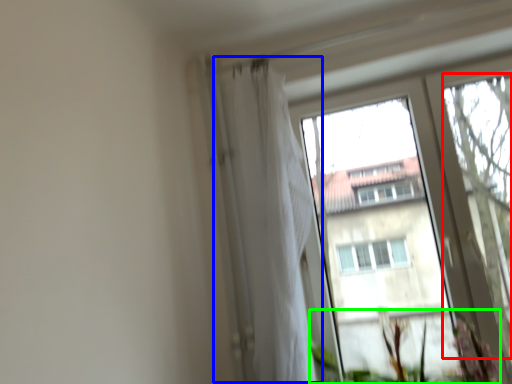
Question: Considering the real-world distances, which object is closest to tree (highlighted by a red box)? shower curtain (highlighted by a blue box) or vegetation (highlighted by a green box).

Choices:
 (A) shower curtain
 (B) vegetation

Answer: (B)